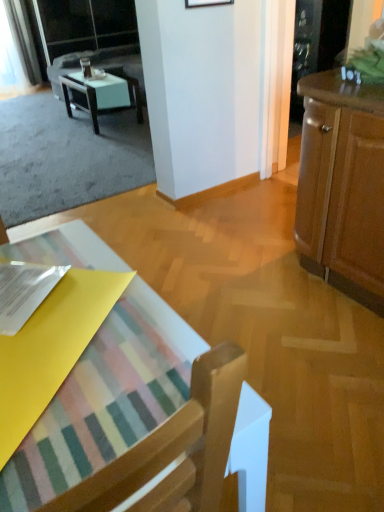
Question: Can you confirm if transparent glass screen door at upper left, the 2th screen door from the right, is wider than transparent glass cabinet at upper right, which ranks as the 1th screen door in front-to-back order?

Choices:
 (A) no
 (B) yes

Answer: (B)

Question: From the image's perspective, does transparent glass screen door at upper left, which ranks as the second screen door in bottom-to-top order, appear higher than transparent glass cabinet at upper right, the 1th screen door in the bottom-to-top sequence?

Choices:
 (A) yes
 (B) no

Answer: (A)

Question: Can transparent glass cabinet at upper right, which is the 1th screen door from right to left, be found inside transparent glass screen door at upper left, which ranks as the second screen door in bottom-to-top order?

Choices:
 (A) no
 (B) yes

Answer: (A)

Question: Is transparent glass screen door at upper left, which ranks as the second screen door in bottom-to-top order, bigger than transparent glass cabinet at upper right, which ranks as the 1th screen door in front-to-back order?

Choices:
 (A) yes
 (B) no

Answer: (A)

Question: Is transparent glass screen door at upper left, the 2th screen door from the right, outside of transparent glass cabinet at upper right, which is the 1th screen door from right to left?

Choices:
 (A) yes
 (B) no

Answer: (A)

Question: Considering the positions of wooden picture frame at upper center and matte black couch at upper left in the image, is wooden picture frame at upper center taller or shorter than matte black couch at upper left?

Choices:
 (A) tall
 (B) short

Answer: (B)

Question: Does point (192, 2) appear closer or farther from the camera than point (140, 72)?

Choices:
 (A) closer
 (B) farther

Answer: (A)

Question: Considering the positions of wooden picture frame at upper center and matte black couch at upper left in the image, is wooden picture frame at upper center bigger or smaller than matte black couch at upper left?

Choices:
 (A) big
 (B) small

Answer: (B)

Question: Considering their positions, is wooden picture frame at upper center located in front of or behind matte black couch at upper left?

Choices:
 (A) front
 (B) behind

Answer: (A)

Question: From a real-world perspective, is transparent glass screen door at upper left, the 2th screen door positioned from the front, physically located above or below transparent glass cabinet at upper right, acting as the 2th screen door starting from the left?

Choices:
 (A) below
 (B) above

Answer: (B)

Question: Is point (72, 5) closer or farther from the camera than point (327, 34)?

Choices:
 (A) farther
 (B) closer

Answer: (A)

Question: From their relative heights in the image, would you say transparent glass screen door at upper left, which ranks as the second screen door in bottom-to-top order, is taller or shorter than transparent glass cabinet at upper right, acting as the second screen door starting from the back?

Choices:
 (A) short
 (B) tall

Answer: (B)

Question: From the image's perspective, is transparent glass screen door at upper left, the 2th screen door from the right, above or below transparent glass cabinet at upper right, acting as the second screen door starting from the top?

Choices:
 (A) below
 (B) above

Answer: (B)

Question: In terms of height, does wooden chair at lower left look taller or shorter compared to white glossy table at upper left?

Choices:
 (A) short
 (B) tall

Answer: (B)

Question: In terms of width, does wooden chair at lower left look wider or thinner when compared to white glossy table at upper left?

Choices:
 (A) thin
 (B) wide

Answer: (B)